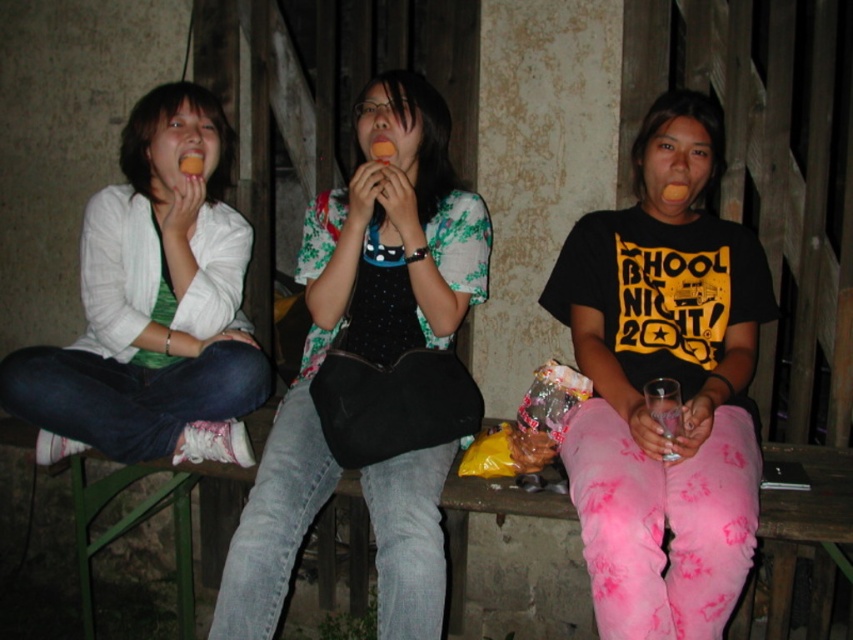
Between point (759, 262) and point (143, 134), which one is positioned in front?

Point (759, 262)

Can you confirm if matte black t-shirt at center is positioned below matte white cardigan at left?

Yes.

Who is more forward, (x=627, y=637) or (x=190, y=348)?

Point (x=627, y=637)

Where is `matte black t-shirt at center`? Image resolution: width=853 pixels, height=640 pixels. matte black t-shirt at center is located at coordinates (664, 378).

Looking at this image, who is lower down, matte black t-shirt at center or floral fabric top at center?

matte black t-shirt at center

Between point (693, 180) and point (437, 196), which one is positioned behind?

The point (437, 196) is behind.

Between point (711, 620) and point (439, 458), which one is positioned in front?

Point (711, 620)

Identify the location of matte black t-shirt at center. (664, 378).

Can you confirm if floral fabric top at center is positioned to the left of matte white cardigan at left?

In fact, floral fabric top at center is to the right of matte white cardigan at left.

How far apart are floral fabric top at center and matte white cardigan at left?

The distance of floral fabric top at center from matte white cardigan at left is 16.20 inches.

Is point (347, 200) farther from camera compared to point (108, 275)?

That is False.

You are a GUI agent. You are given a task and a screenshot of the screen. Output one action in this format:
    pyautogui.click(x=<x>, y=<y>)
    Task: Click on the floral fabric top at center
    The height and width of the screenshot is (640, 853).
    Given the screenshot: What is the action you would take?
    pyautogui.click(x=357, y=321)